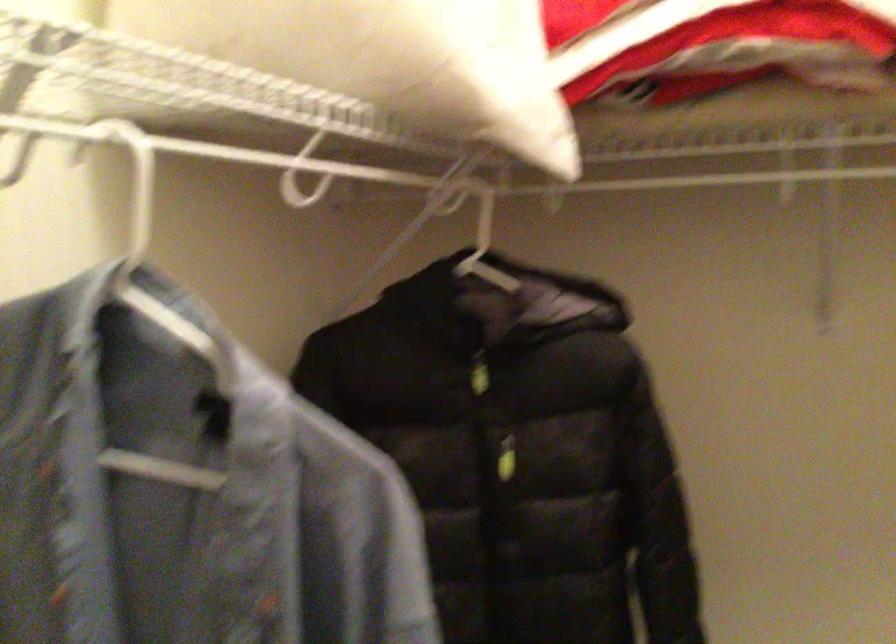
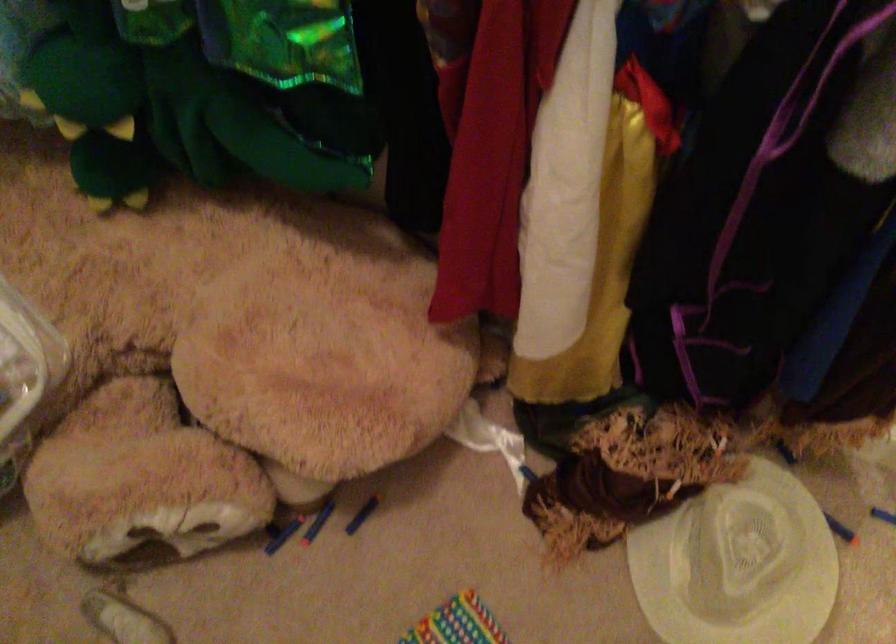
How did the camera likely rotate?

The rotation direction of the camera is right-down.